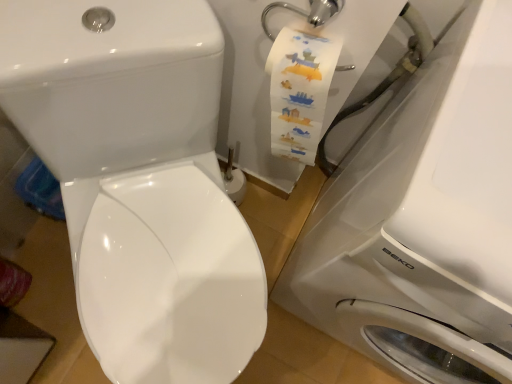
What are the coordinates of `white glossy washing machine at right` in the screenshot? It's located at (423, 220).

Describe the element at coordinates (423, 220) in the screenshot. This screenshot has width=512, height=384. I see `white glossy washing machine at right` at that location.

Describe the element at coordinates (139, 182) in the screenshot. The width and height of the screenshot is (512, 384). I see `white glossy toilet at center` at that location.

At what (x,y) coordinates should I click in order to perform the action: click on white glossy toilet at center. Please return your answer as a coordinate pair (x, y). Looking at the image, I should click on (139, 182).

What are the coordinates of `white glossy washing machine at right` in the screenshot? It's located at (423, 220).

Considering the relative positions of white glossy washing machine at right and white glossy toilet at center in the image provided, is white glossy washing machine at right to the left of white glossy toilet at center from the viewer's perspective?

Incorrect, white glossy washing machine at right is not on the left side of white glossy toilet at center.

Considering the positions of objects white glossy washing machine at right and white glossy toilet at center in the image provided, who is in front, white glossy washing machine at right or white glossy toilet at center?

white glossy washing machine at right is closer to the camera.

Does point (472, 111) come closer to viewer compared to point (218, 79)?

That is True.

From the image's perspective, is white glossy washing machine at right located above white glossy toilet at center?

No, from the image's perspective, white glossy washing machine at right is not over white glossy toilet at center.

From a real-world perspective, is white glossy washing machine at right physically located above or below white glossy toilet at center?

Clearly, from a real-world perspective, white glossy washing machine at right is above white glossy toilet at center.

Is white glossy washing machine at right thinner than white glossy toilet at center?

Yes, white glossy washing machine at right is thinner than white glossy toilet at center.

Considering the sizes of white glossy washing machine at right and white glossy toilet at center in the image, is white glossy washing machine at right taller or shorter than white glossy toilet at center?

white glossy washing machine at right is taller than white glossy toilet at center.

Does white glossy washing machine at right have a larger size compared to white glossy toilet at center?

Indeed, white glossy washing machine at right has a larger size compared to white glossy toilet at center.

Would you say white glossy washing machine at right is inside or outside white glossy toilet at center?

white glossy washing machine at right exists outside the volume of white glossy toilet at center.

Is white glossy washing machine at right far away from white glossy toilet at center?

No, white glossy washing machine at right is not far away from white glossy toilet at center.

Is white glossy washing machine at right oriented away from white glossy toilet at center?

No, white glossy washing machine at right is not facing away from white glossy toilet at center.

You are a GUI agent. You are given a task and a screenshot of the screen. Output one action in this format:
    pyautogui.click(x=<x>, y=<y>)
    Task: Click on the toilet lying behind the white glossy washing machine at right
    The height and width of the screenshot is (384, 512).
    Given the screenshot: What is the action you would take?
    pyautogui.click(x=139, y=182)

Which object is positioned more to the left, white glossy toilet at center or white glossy washing machine at right?

white glossy toilet at center.

Considering their positions, is white glossy toilet at center located in front of or behind white glossy washing machine at right?

white glossy toilet at center is behind white glossy washing machine at right.

Considering the positions of point (166, 34) and point (403, 351), is point (166, 34) closer or farther from the camera than point (403, 351)?

Point (166, 34) appears to be closer to the viewer than point (403, 351).

From the image's perspective, would you say white glossy toilet at center is shown under white glossy washing machine at right?

No.

From a real-world perspective, is white glossy toilet at center physically located above or below white glossy washing machine at right?

From a real-world perspective, white glossy toilet at center is physically below white glossy washing machine at right.

In terms of width, does white glossy toilet at center look wider or thinner when compared to white glossy washing machine at right?

white glossy toilet at center is wider than white glossy washing machine at right.

Is white glossy toilet at center shorter than white glossy washing machine at right?

Indeed, white glossy toilet at center has a lesser height compared to white glossy washing machine at right.

Can you confirm if white glossy toilet at center is smaller than white glossy washing machine at right?

Correct, white glossy toilet at center occupies less space than white glossy washing machine at right.

Choose the correct answer: Is white glossy toilet at center inside white glossy washing machine at right or outside it?

white glossy toilet at center is not inside white glossy washing machine at right, it's outside.

Does white glossy toilet at center touch white glossy washing machine at right?

They are not placed beside each other.

Does white glossy toilet at center turn towards white glossy washing machine at right?

No, white glossy toilet at center is not turned towards white glossy washing machine at right.

Looking at this image, can you tell me how much white glossy toilet at center and white glossy washing machine at right differ in facing direction?

43 degrees.

I want to click on toilet behind the white glossy washing machine at right, so click(x=139, y=182).

Locate an element on the screen. Image resolution: width=512 pixels, height=384 pixels. washing machine in front of the white glossy toilet at center is located at coordinates pos(423,220).

Find the location of a particular element. toilet lying above the white glossy washing machine at right (from the image's perspective) is located at coordinates (139, 182).